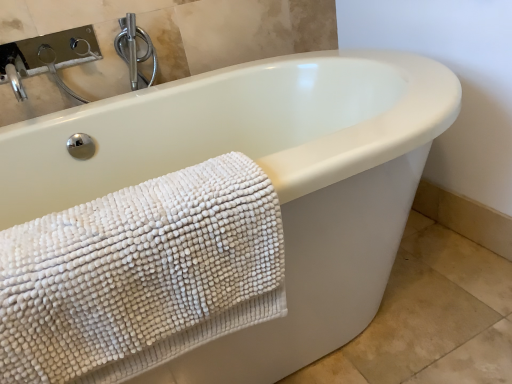
I want to click on satin nickel faucet at upper left, so click(x=134, y=49).

The height and width of the screenshot is (384, 512). What do you see at coordinates (134, 49) in the screenshot? I see `satin nickel faucet at upper left` at bounding box center [134, 49].

The image size is (512, 384). What do you see at coordinates (141, 275) in the screenshot?
I see `white chenille towel at lower left` at bounding box center [141, 275].

Where is `white chenille towel at lower left`? The image size is (512, 384). white chenille towel at lower left is located at coordinates (141, 275).

The width and height of the screenshot is (512, 384). Identify the location of satin nickel faucet at upper left. (134, 49).

Which object is positioned more to the right, white chenille towel at lower left or satin nickel faucet at upper left?

white chenille towel at lower left.

Which object is further away from the camera taking this photo, white chenille towel at lower left or satin nickel faucet at upper left?

satin nickel faucet at upper left is behind.

Between point (49, 381) and point (121, 22), which one is positioned in front?

The point (49, 381) is closer.

From the image's perspective, which one is positioned higher, white chenille towel at lower left or satin nickel faucet at upper left?

satin nickel faucet at upper left.

From a real-world perspective, who is located lower, white chenille towel at lower left or satin nickel faucet at upper left?

In real-world perspective, white chenille towel at lower left is lower.

Which of these two, white chenille towel at lower left or satin nickel faucet at upper left, is thinner?

satin nickel faucet at upper left.

Is white chenille towel at lower left taller or shorter than satin nickel faucet at upper left?

Clearly, white chenille towel at lower left is taller compared to satin nickel faucet at upper left.

Which of these two, white chenille towel at lower left or satin nickel faucet at upper left, is smaller?

Smaller between the two is satin nickel faucet at upper left.

Choose the correct answer: Is white chenille towel at lower left inside satin nickel faucet at upper left or outside it?

white chenille towel at lower left is outside satin nickel faucet at upper left.

Is white chenille towel at lower left placed right next to satin nickel faucet at upper left?

white chenille towel at lower left and satin nickel faucet at upper left are not in contact.

Could you tell me if white chenille towel at lower left is turned towards satin nickel faucet at upper left?

No.

How many degrees apart are the facing directions of white chenille towel at lower left and satin nickel faucet at upper left?

The angle between the facing direction of white chenille towel at lower left and the facing direction of satin nickel faucet at upper left is 0.0669 degrees.

Measure the distance between white chenille towel at lower left and satin nickel faucet at upper left.

A distance of 36.23 inches exists between white chenille towel at lower left and satin nickel faucet at upper left.

I want to click on towel beneath the satin nickel faucet at upper left (from a real-world perspective), so click(141, 275).

Does satin nickel faucet at upper left appear on the right side of white chenille towel at lower left?

No.

Is satin nickel faucet at upper left positioned in front of white chenille towel at lower left?

No, it is not.

Considering the positions of points (132, 53) and (209, 218), is point (132, 53) closer to camera compared to point (209, 218)?

No, it is behind (209, 218).

From the image's perspective, who appears lower, satin nickel faucet at upper left or white chenille towel at lower left?

white chenille towel at lower left.

From a real-world perspective, which object stands above the other?

In real-world perspective, satin nickel faucet at upper left is above.

Which object is thinner, satin nickel faucet at upper left or white chenille towel at lower left?

Thinner between the two is satin nickel faucet at upper left.

Based on the photo, does satin nickel faucet at upper left have a lesser height compared to white chenille towel at lower left?

Yes.

Is satin nickel faucet at upper left bigger than white chenille towel at lower left?

Actually, satin nickel faucet at upper left might be smaller than white chenille towel at lower left.

Consider the image. Does satin nickel faucet at upper left contain white chenille towel at lower left?

No, white chenille towel at lower left is not a part of satin nickel faucet at upper left.

Is satin nickel faucet at upper left far away from white chenille towel at lower left?

Actually, satin nickel faucet at upper left and white chenille towel at lower left are a little close together.

Is satin nickel faucet at upper left oriented away from white chenille towel at lower left?

No, satin nickel faucet at upper left is not facing the opposite direction of white chenille towel at lower left.

How different are the orientations of satin nickel faucet at upper left and white chenille towel at lower left in degrees?

The angle between the facing direction of satin nickel faucet at upper left and the facing direction of white chenille towel at lower left is 0.0669 degrees.

The height and width of the screenshot is (384, 512). In order to click on faucet lying behind the white chenille towel at lower left in this screenshot , I will do `click(134, 49)`.

Where is `faucet that appears behind the white chenille towel at lower left`? This screenshot has height=384, width=512. faucet that appears behind the white chenille towel at lower left is located at coordinates (134, 49).

This screenshot has width=512, height=384. Identify the location of towel that is under the satin nickel faucet at upper left (from a real-world perspective). (141, 275).